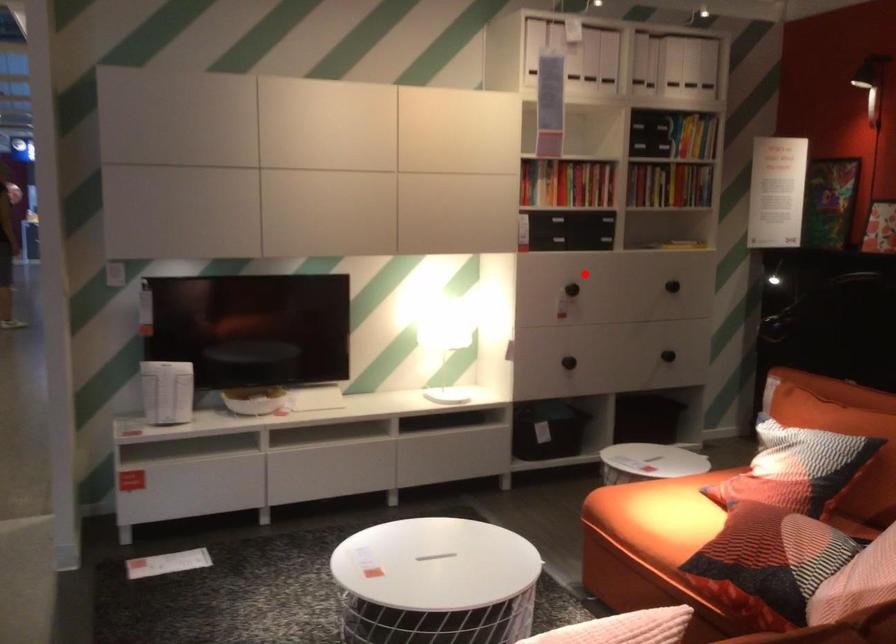
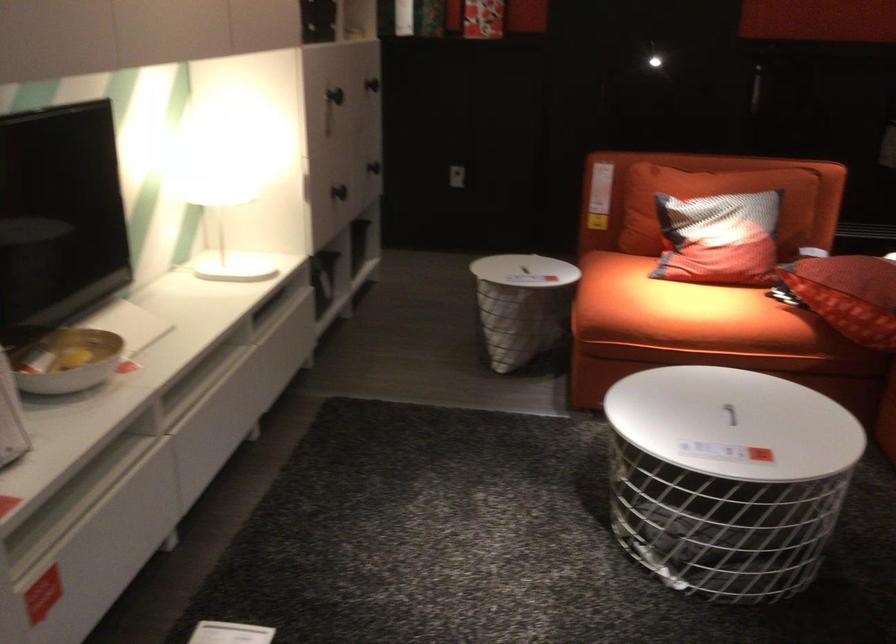
Question: I am providing you with two images of the same scene from different viewpoints. A red point is shown in image1. For the corresponding object point in image2, is it positioned nearer or farther from the camera?

Choices:
 (A) Nearer
 (B) Farther

Answer: (A)